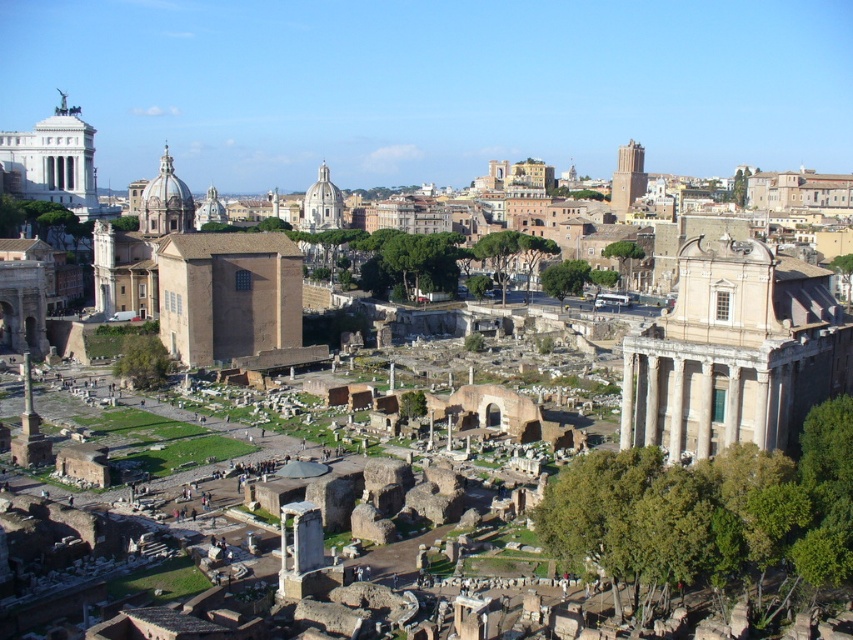
Which is below, white marble ruins at center right or brown brick wall at center?

Positioned lower is white marble ruins at center right.

What do you see at coordinates (734, 353) in the screenshot? I see `white marble ruins at center right` at bounding box center [734, 353].

What are the coordinates of `white marble ruins at center right` in the screenshot? It's located at (734, 353).